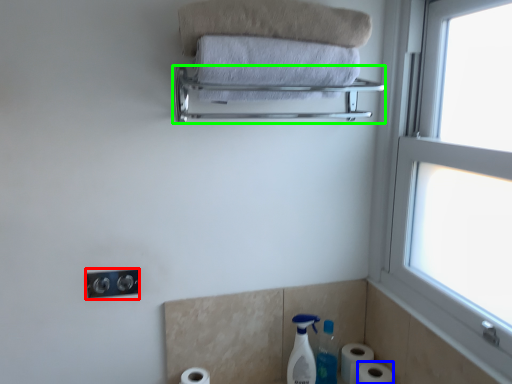
Question: Which object is positioned closest to electric outlet (highlighted by a red box)? Select from toilet paper (highlighted by a blue box) and balustrade (highlighted by a green box).

Choices:
 (A) toilet paper
 (B) balustrade

Answer: (B)